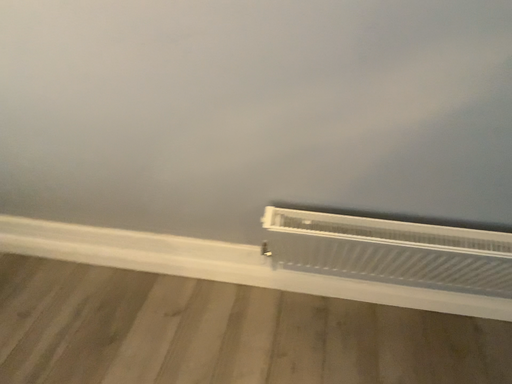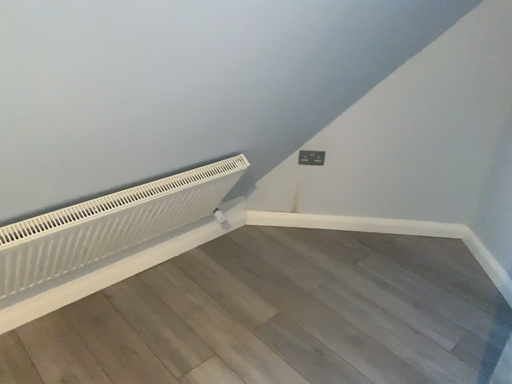
Question: How did the camera likely rotate when shooting the video?

Choices:
 (A) rotated right
 (B) rotated left

Answer: (A)